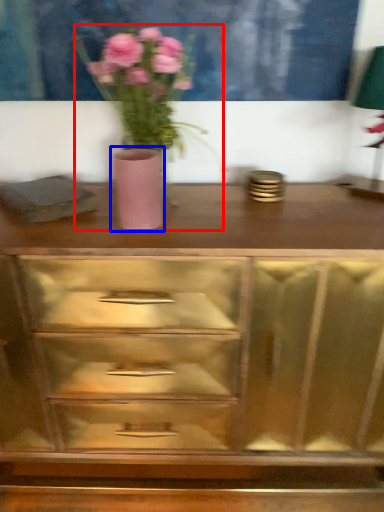
Question: Which point is further to the camera, floral arrangement (highlighted by a red box) or vase (highlighted by a blue box)?

Choices:
 (A) floral arrangement
 (B) vase

Answer: (B)